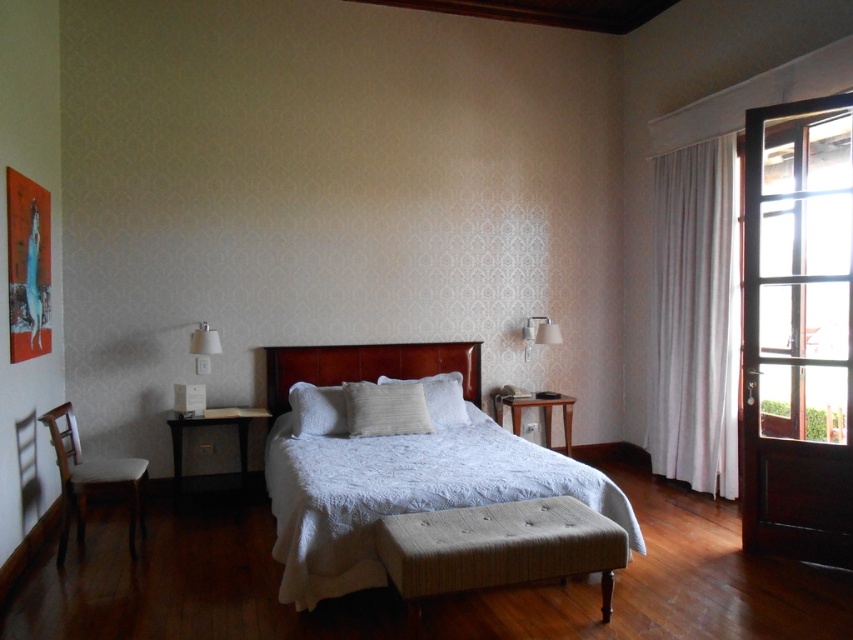
Based on the photo, you are trying to place a new decorative item on the white textured bed at center and the black wood side table at lower left. Which surface has a larger width?

The white textured bed at center is wider than the black wood side table at lower left according to the description.